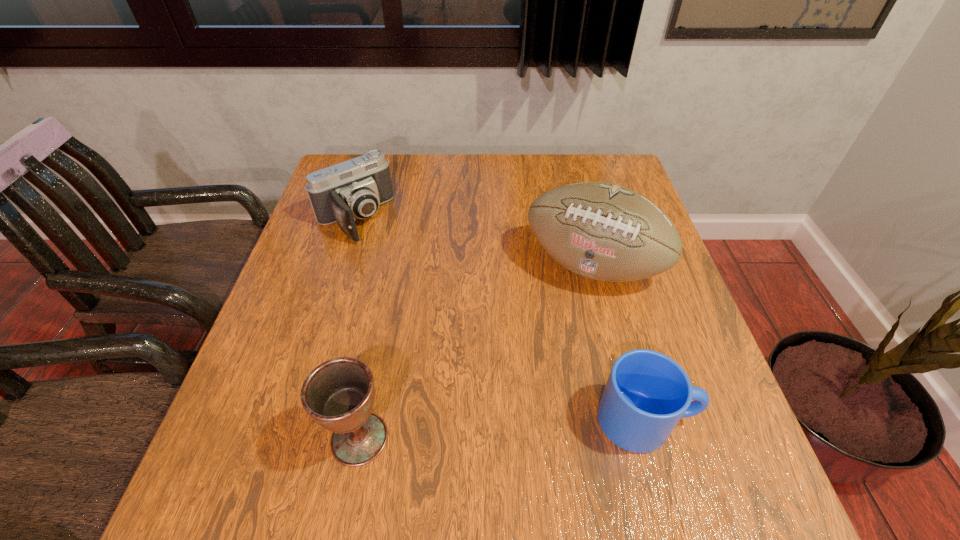
Image resolution: width=960 pixels, height=540 pixels. What are the coordinates of `vacant position in the image that satisfies the following two spatial constraints: 1. on the back side of the chalice; 2. on the left side of the football (American)` in the screenshot? It's located at (394, 266).